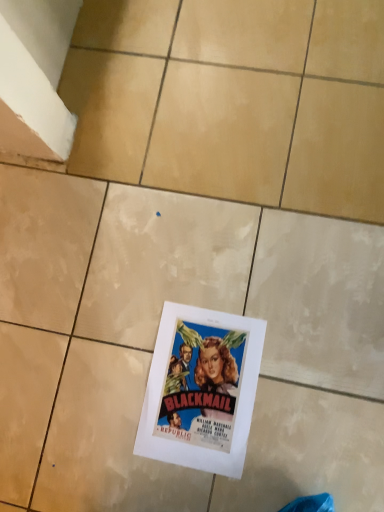
The image size is (384, 512). Find the location of `empty space that is ontop of matte paper poster at center (from a real-world perspective)`. empty space that is ontop of matte paper poster at center (from a real-world perspective) is located at coordinates (205, 389).